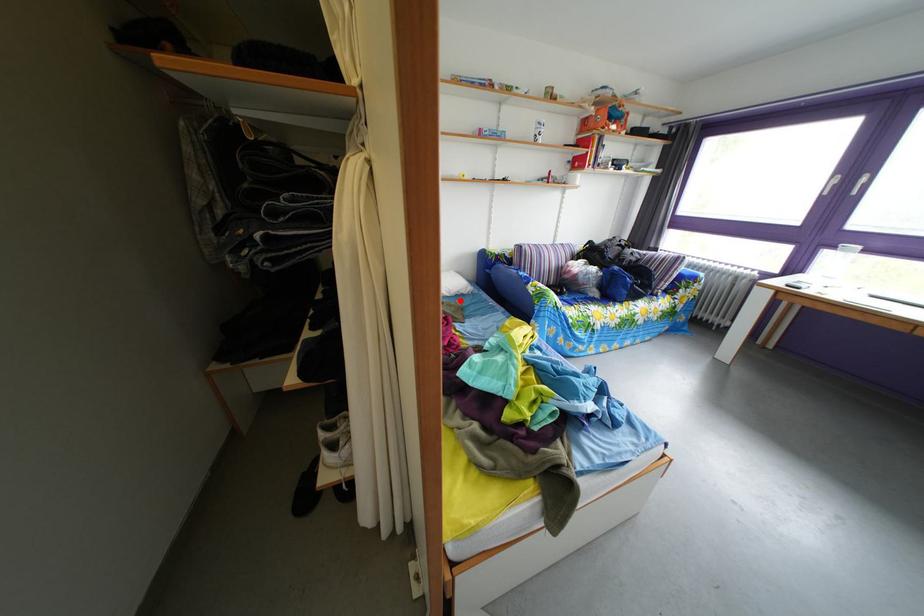
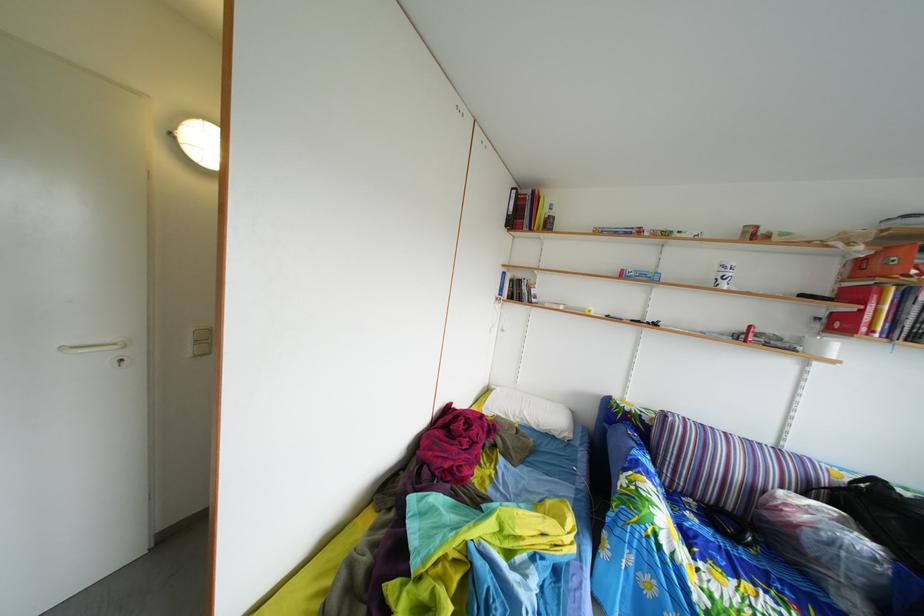
Locate, in the second image, the point that corresponds to the highlighted location in the first image.

(549, 434)